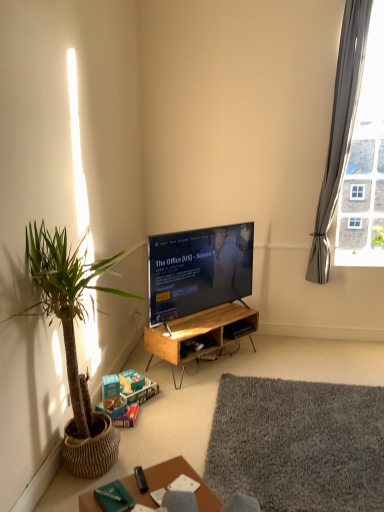
Question: Is matte black tv at center wider or thinner than green woven pot at left?

Choices:
 (A) wide
 (B) thin

Answer: (B)

Question: Visually, is matte black tv at center positioned to the left or to the right of green woven pot at left?

Choices:
 (A) left
 (B) right

Answer: (B)

Question: Which object is positioned farthest from the green woven pot at left?

Choices:
 (A) gray shaggy rug at lower center
 (B) gray fabric curtain at upper right
 (C) black plastic remote control at lower center
 (D) wooden table at lower center
 (E) woodenmaterial/texturedesk at center

Answer: (B)

Question: Considering the real-world distances, which object is closest to the black plastic remote control at lower center?

Choices:
 (A) gray fabric curtain at upper right
 (B) gray shaggy rug at lower center
 (C) green woven pot at left
 (D) woodenmaterial/texturedesk at center
 (E) matte black tv at center

Answer: (C)